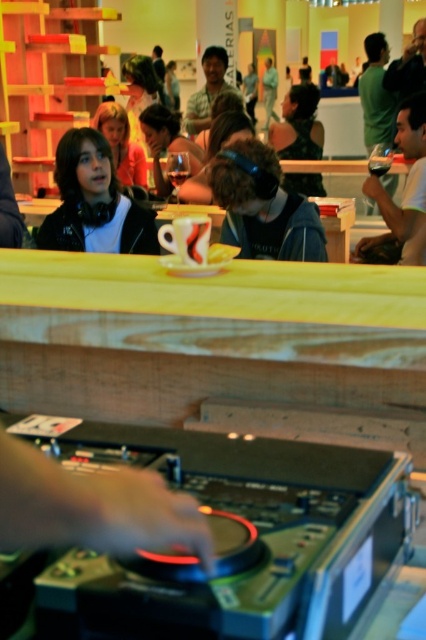
Does dark blue headphones at center appear over matte black headphones at upper left?

No, dark blue headphones at center is not above matte black headphones at upper left.

Is dark blue headphones at center positioned before matte black headphones at upper left?

Yes, dark blue headphones at center is in front of matte black headphones at upper left.

This screenshot has width=426, height=640. In order to click on dark blue headphones at center in this screenshot , I will do `click(264, 205)`.

Does matte black headphones at upper right have a larger size compared to black fabric dress at upper center?

No.

Between point (385, 208) and point (305, 93), which one is positioned in front?

Point (385, 208) is in front.

Locate an element on the screen. The height and width of the screenshot is (640, 426). matte black headphones at upper right is located at coordinates (405, 184).

Which is above, dark blue headphones at center or matte black headphones at upper right?

matte black headphones at upper right is above.

From the picture: Can you confirm if dark blue headphones at center is wider than matte black headphones at upper right?

Indeed, dark blue headphones at center has a greater width compared to matte black headphones at upper right.

Is point (322, 237) positioned in front of point (423, 211)?

Yes.

Identify the location of dark blue headphones at center. Image resolution: width=426 pixels, height=640 pixels. (264, 205).